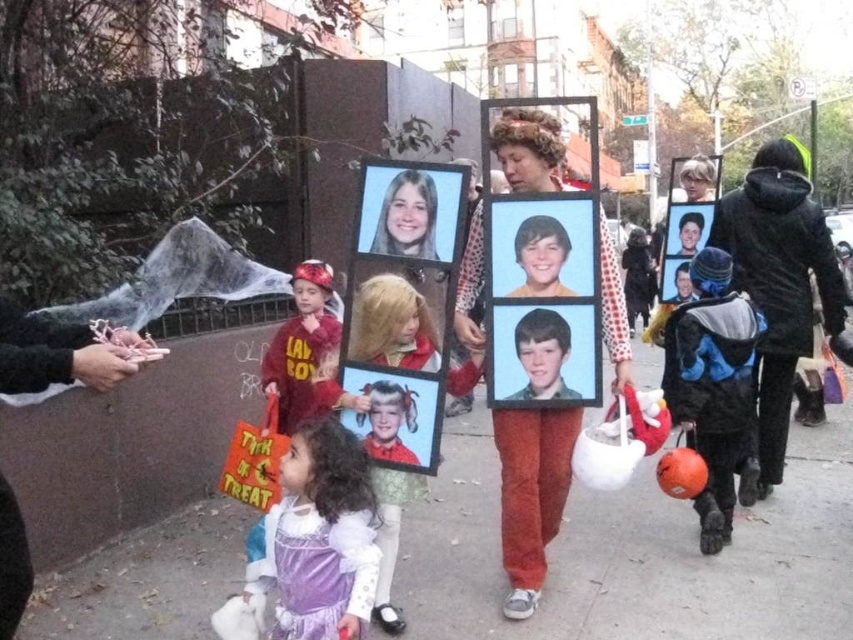
You are a parent trying to choose between two photo frames for your child. The matte plastic picture frame at center and the smooth plastic photo frame at center are both available. Based on the scene description, which frame is taller?

The matte plastic picture frame at center is taller than the smooth plastic photo frame at center according to the scene description.

You are a photographer trying to capture a clear shot of both the shiny red helmet at center and the smooth plastic photo frame at center. Based on their positions, which object should you focus on first to ensure it appears sharp in the photo?

The smooth plastic photo frame at center is behind the shiny red helmet at center, so you should focus on the shiny red helmet at center first to ensure both are in focus.